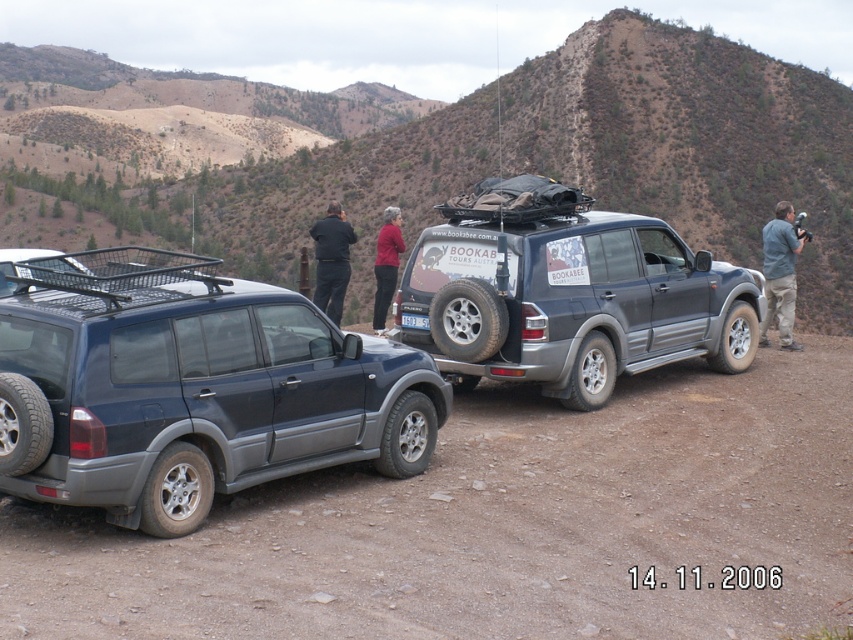
Question: Can you confirm if blue fabric jacket at upper right is positioned above dark red sweater at center?

Choices:
 (A) yes
 (B) no

Answer: (A)

Question: Which of the following is the farthest from the observer?

Choices:
 (A) dark blue jeans at center
 (B) dark red sweater at center
 (C) metallic gray suv at center

Answer: (A)

Question: Is brown rocky hillside at upper center wider than white plastic license plate at center?

Choices:
 (A) no
 (B) yes

Answer: (B)

Question: Based on their relative distances, which object is farther from the brown rocky hillside at upper center?

Choices:
 (A) metallic gray suv at center-left
 (B) dirt track at center
 (C) blue fabric jacket at upper right

Answer: (B)

Question: Among these objects, which one is nearest to the camera?

Choices:
 (A) metallic gray suv at center
 (B) dark red sweater at center
 (C) dark blue jeans at center

Answer: (A)

Question: Does brown rocky hillside at upper center have a lesser width compared to dark red sweater at center?

Choices:
 (A) yes
 (B) no

Answer: (B)